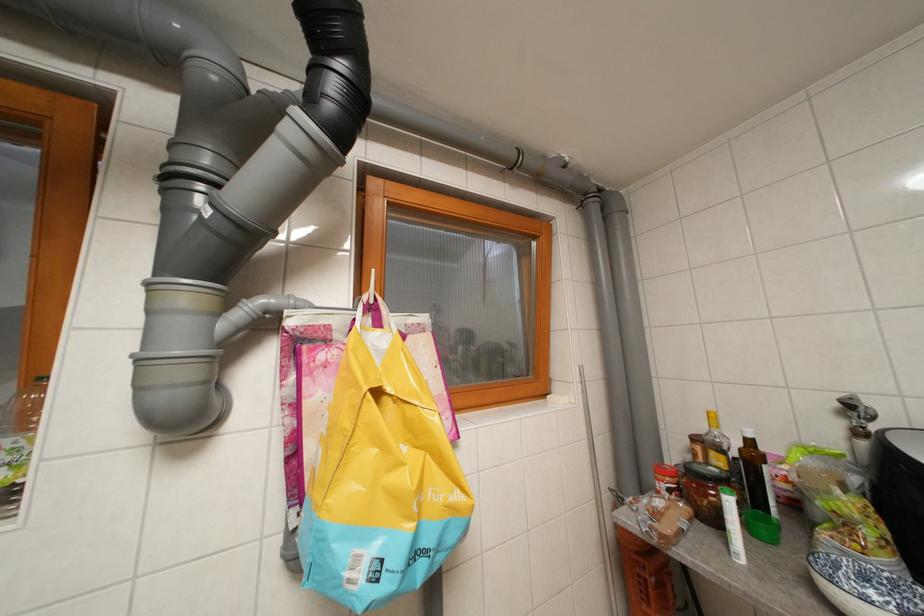
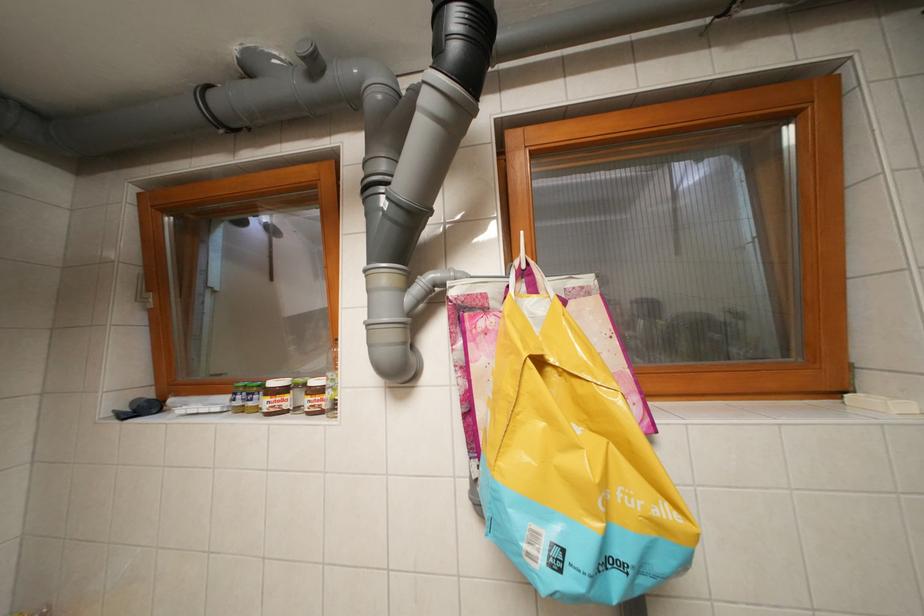
Question: Based on the continuous images, in which direction is the camera rotating? Reply with the corresponding letter.

Choices:
 (A) Left
 (B) Right
 (C) Up
 (D) Down

Answer: (A)